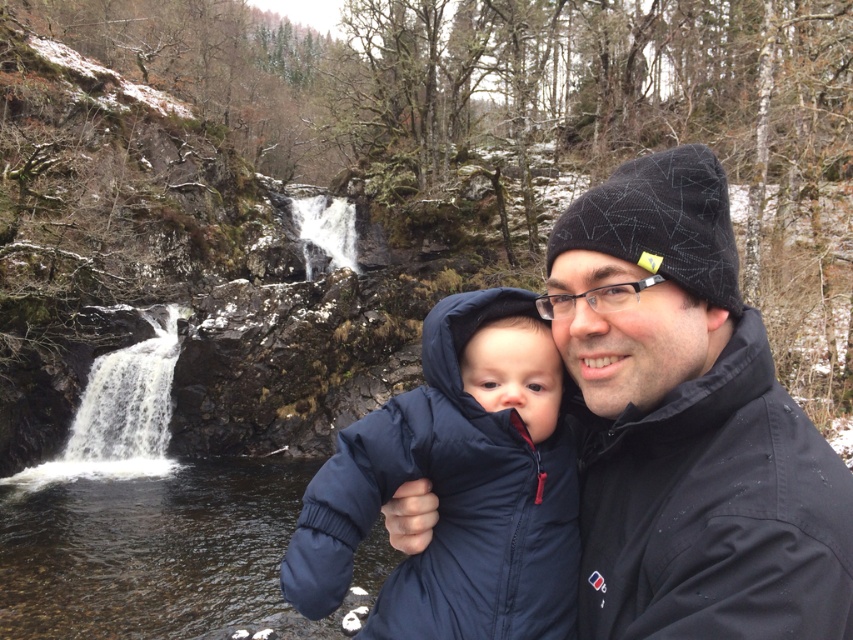
Does black matte jacket at right have a greater width compared to navy blue puffer jacket at center?

Correct, the width of black matte jacket at right exceeds that of navy blue puffer jacket at center.

Can you confirm if black matte jacket at right is shorter than navy blue puffer jacket at center?

Result: No, black matte jacket at right is not shorter than navy blue puffer jacket at center.

Which is in front, point (828, 513) or point (515, 339)?

Point (828, 513) is more forward.

Where is `black matte jacket at right`? The image size is (853, 640). black matte jacket at right is located at coordinates (712, 509).

Does point (711, 451) lie in front of point (514, 416)?

Yes, point (711, 451) is closer to viewer.

Between black matte jacket at right and navy puffy jacket at center, which one appears on the left side from the viewer's perspective?

From the viewer's perspective, navy puffy jacket at center appears more on the left side.

Find the location of `black matte jacket at right`. black matte jacket at right is located at coordinates tap(712, 509).

Is navy puffy jacket at center to the left of navy blue puffer jacket at center from the viewer's perspective?

Result: Yes, navy puffy jacket at center is to the left of navy blue puffer jacket at center.

Which is in front, point (431, 628) or point (538, 362)?

Point (431, 628) is in front.

Where is `navy puffy jacket at center`? The image size is (853, 640). navy puffy jacket at center is located at coordinates (448, 502).